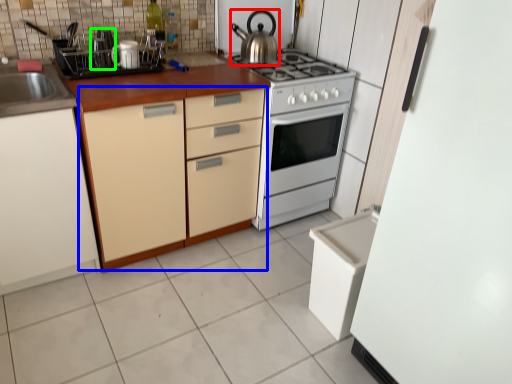
Question: Which object is positioned farthest from kitchen appliance (highlighted by a red box)? Select from cabinetry (highlighted by a blue box) and appliance (highlighted by a green box).

Choices:
 (A) cabinetry
 (B) appliance

Answer: (B)